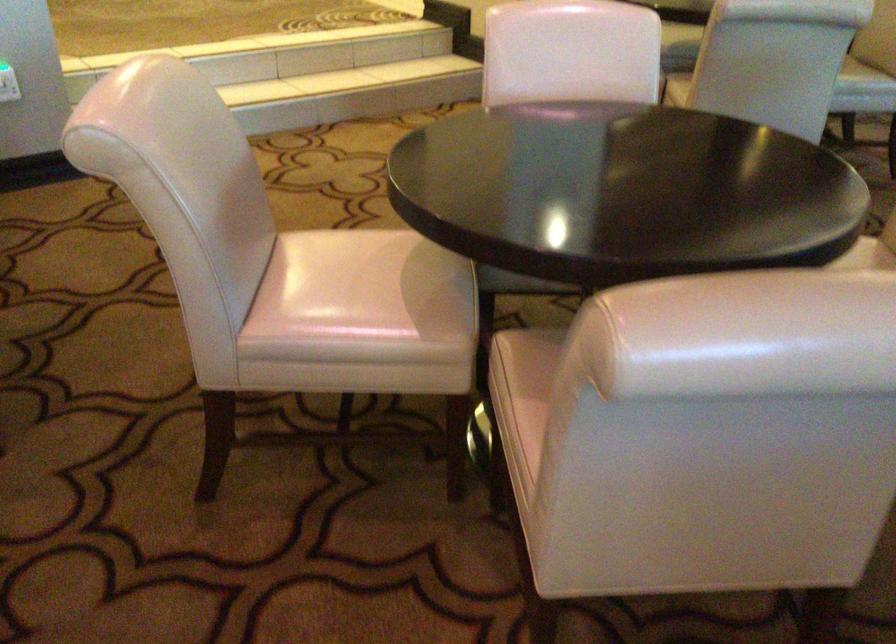
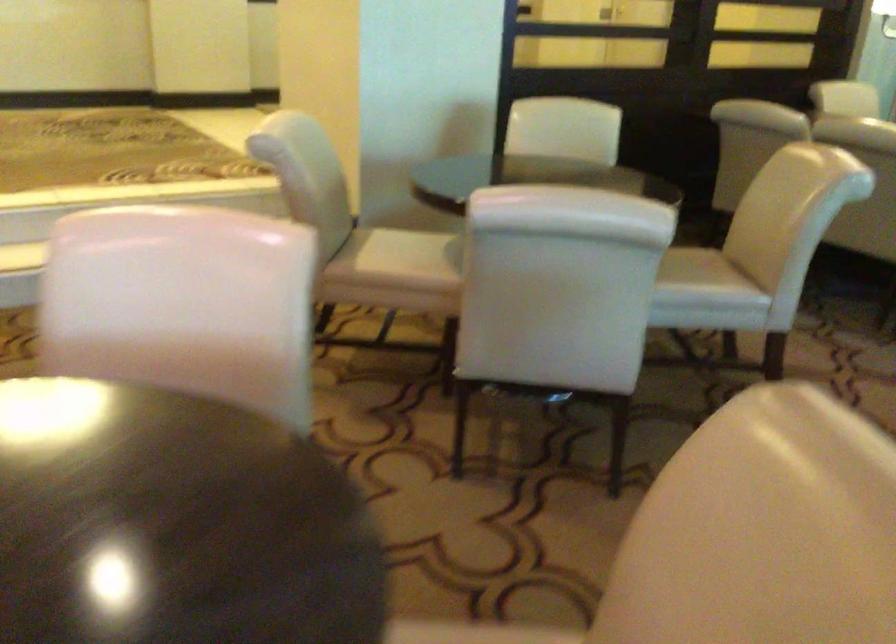
The images are taken continuously from a first-person perspective. In which direction are you moving?

The cameraman walked toward right, forward.